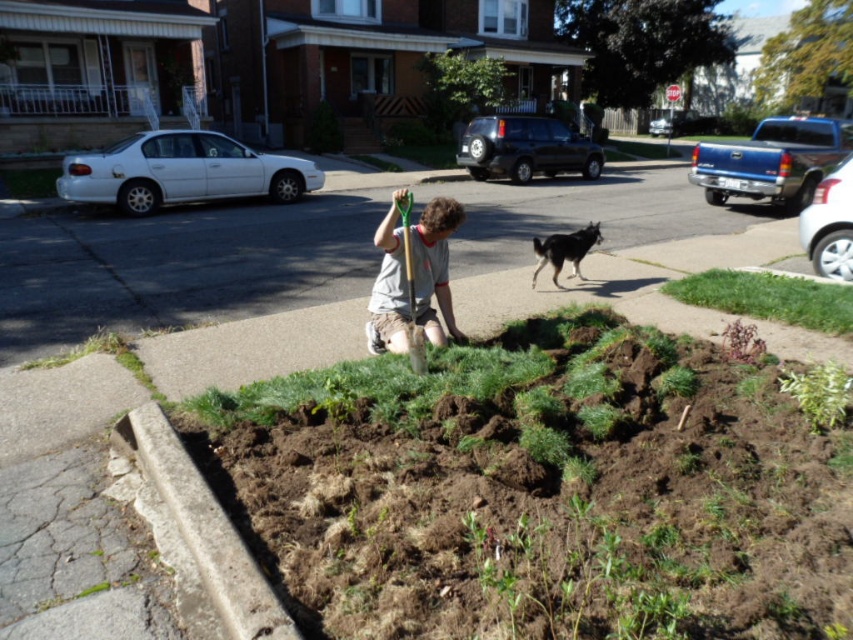
Between concrete at lower left and green grass at lower right, which one appears on the left side from the viewer's perspective?

concrete at lower left

Who is more distant from viewer, (239, 634) or (802, 298)?

A: The point (802, 298) is behind.

Identify the location of concrete at lower left. (206, 529).

Is black fur dog at center shorter than green grass at lower left?

Incorrect, black fur dog at center's height does not fall short of green grass at lower left's.

Does point (553, 246) come in front of point (38, 368)?

No, it is not.

Locate an element on the screen. black fur dog at center is located at coordinates [x=564, y=250].

Is point (787, 472) behind point (834, 376)?

That is False.

Can you confirm if brown soil at center is positioned to the left of green leafy plant at lower right?

Correct, you'll find brown soil at center to the left of green leafy plant at lower right.

Is point (720, 540) positioned after point (851, 390)?

No, (720, 540) is in front of (851, 390).

The width and height of the screenshot is (853, 640). Identify the location of brown soil at center. (538, 490).